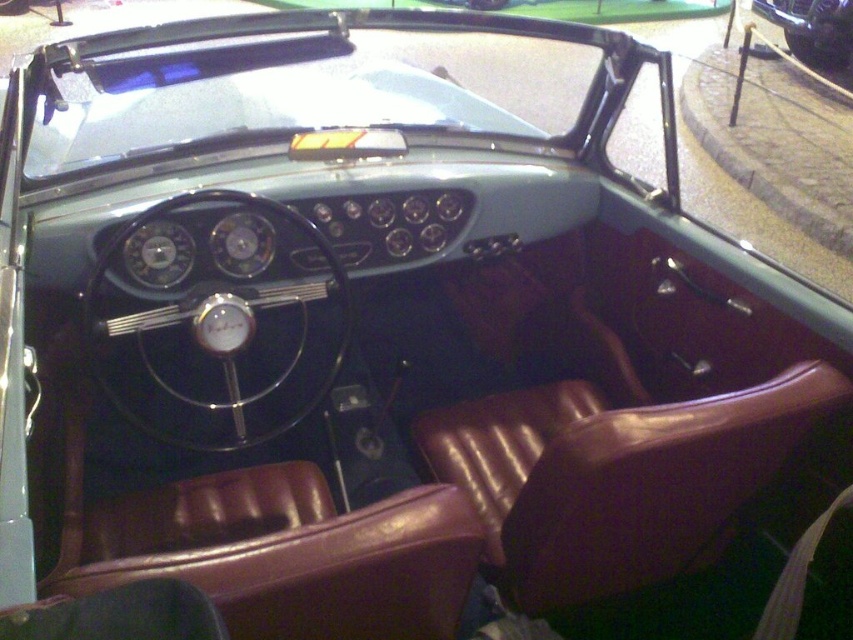
Question: Is black leather steering wheel at center to the left of shiny black car at upper right from the viewer's perspective?

Choices:
 (A) no
 (B) yes

Answer: (B)

Question: Which of the following is the farthest from the observer?

Choices:
 (A) (107, 332)
 (B) (795, 19)

Answer: (B)

Question: Does black leather steering wheel at center appear on the right side of shiny black car at upper right?

Choices:
 (A) no
 (B) yes

Answer: (A)

Question: Does black leather steering wheel at center appear on the left side of shiny black car at upper right?

Choices:
 (A) yes
 (B) no

Answer: (A)

Question: Which point is farther to the camera?

Choices:
 (A) black leather steering wheel at center
 (B) shiny black car at upper right

Answer: (B)